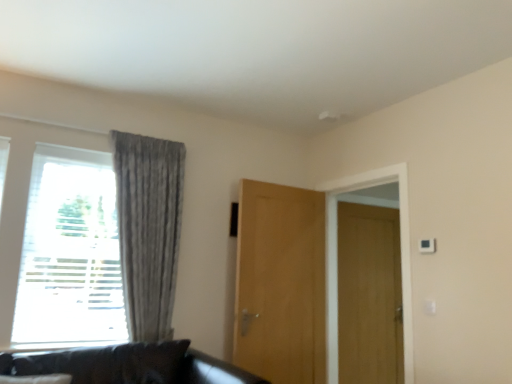
Question: Does point (379, 375) appear closer or farther from the camera than point (167, 206)?

Choices:
 (A) closer
 (B) farther

Answer: (B)

Question: Looking at their shapes, would you say wooden door at right, which ranks as the 2th door in left-to-right order, is wider or thinner than gray textured curtain at left?

Choices:
 (A) wide
 (B) thin

Answer: (B)

Question: Which object is the farthest from the wooden door at right, which ranks as the 2th door in left-to-right order?

Choices:
 (A) gray textured curtain at left
 (B) light brown wood door at center, the second door in the right-to-left sequence
 (C) white textured window at left

Answer: (C)

Question: Which is nearer to the gray textured curtain at left?

Choices:
 (A) white textured window at left
 (B) wooden door at right, the second door viewed from the front
 (C) light brown wood door at center, the second door when ordered from back to front

Answer: (A)